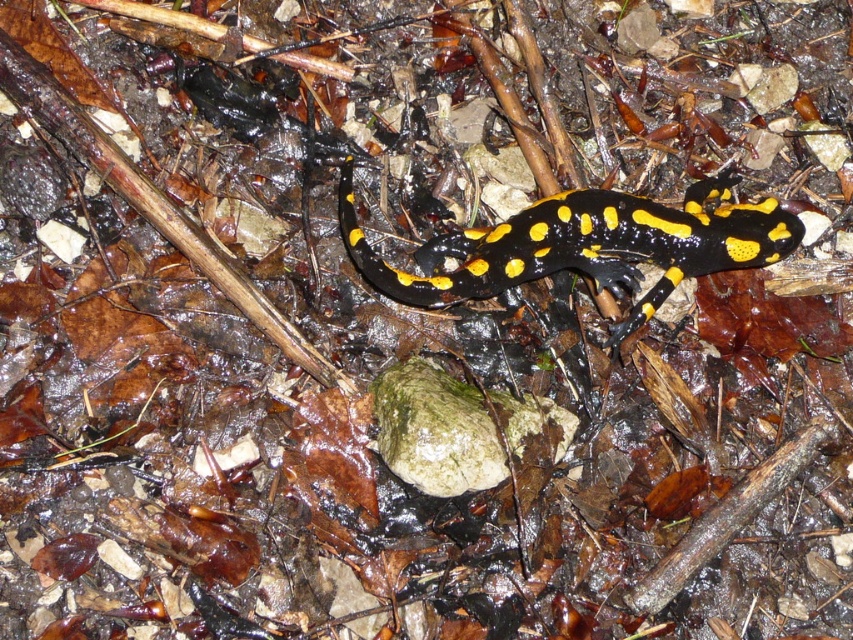
You are a researcher studying the fire salamander in its natural habitat. You notice two points marked on your map at coordinates point (659, 262) and point (486, 476). Based on the image, which point is closer to the white rock near the center?

Point (486, 476) is closer to the white rock near the center because point (659, 262) is behind it, meaning it is farther away from the viewer and thus farther from the central rock.